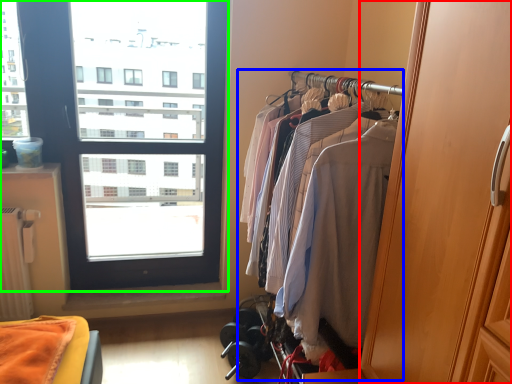
Question: Which object is positioned farthest from screen door (highlighted by a red box)? Select from closet (highlighted by a blue box) and window (highlighted by a green box).

Choices:
 (A) closet
 (B) window

Answer: (B)